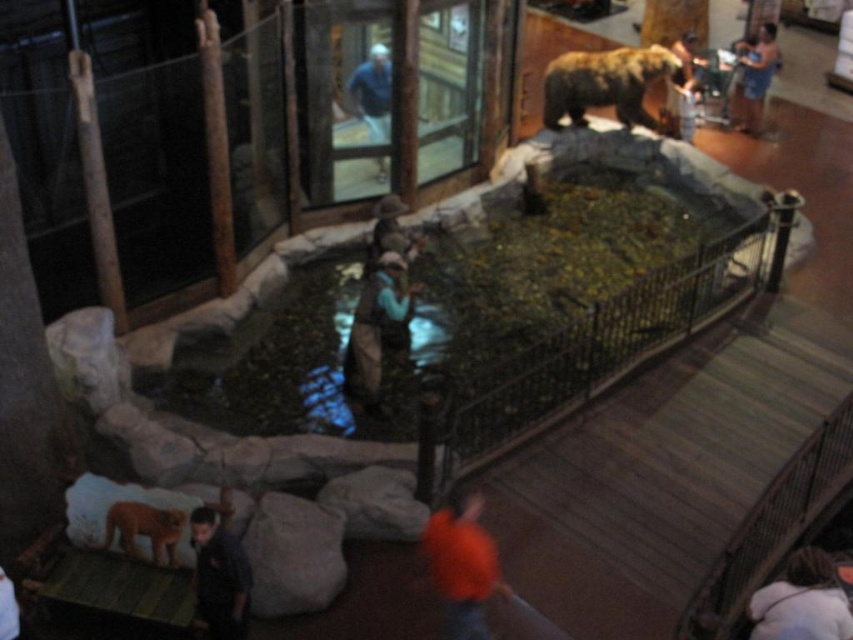
Can you confirm if black metal rail at center is positioned to the left of dark brown hair at lower right?

Indeed, black metal rail at center is positioned on the left side of dark brown hair at lower right.

What do you see at coordinates (610, 340) in the screenshot?
I see `black metal rail at center` at bounding box center [610, 340].

Who is more distant from viewer, (660,301) or (787,573)?

Positioned behind is point (660,301).

This screenshot has width=853, height=640. I want to click on black metal rail at center, so click(x=610, y=340).

The width and height of the screenshot is (853, 640). What do you see at coordinates (462, 563) in the screenshot?
I see `orange fabric shirt at lower center` at bounding box center [462, 563].

Does orange fabric shirt at lower center appear over orange fur tiger at lower left?

Actually, orange fabric shirt at lower center is below orange fur tiger at lower left.

Identify the location of orange fabric shirt at lower center. (462, 563).

Locate an element on the screen. The image size is (853, 640). orange fabric shirt at lower center is located at coordinates (462, 563).

Can you confirm if orange fur tiger at lower left is smaller than blue denim jacket at upper center?

Yes.

This screenshot has height=640, width=853. What do you see at coordinates (143, 529) in the screenshot?
I see `orange fur tiger at lower left` at bounding box center [143, 529].

Does point (161, 513) come farther from viewer compared to point (380, 173)?

No, (161, 513) is closer to viewer.

You are a GUI agent. You are given a task and a screenshot of the screen. Output one action in this format:
    pyautogui.click(x=<x>, y=<y>)
    Task: Click on the orange fur tiger at lower left
    This screenshot has height=640, width=853.
    Given the screenshot: What is the action you would take?
    pyautogui.click(x=143, y=529)